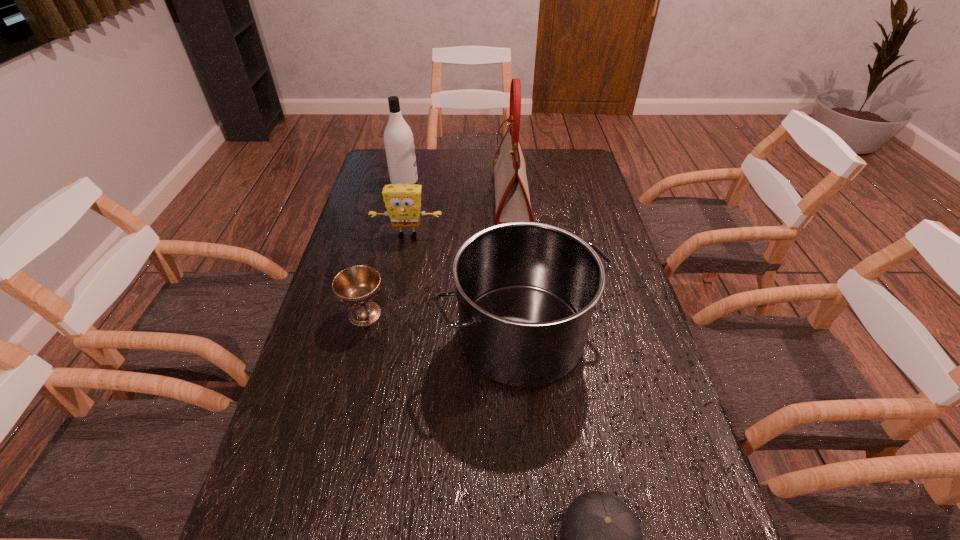
You are a GUI agent. You are given a task and a screenshot of the screen. Output one action in this format:
    pyautogui.click(x=<x>, y=<y>)
    Task: Click on the tallest object
    The image size is (960, 540).
    Given the screenshot: What is the action you would take?
    pos(512,200)

You are a GUI agent. You are given a task and a screenshot of the screen. Output one action in this format:
    pyautogui.click(x=<x>, y=<y>)
    Task: Click on the fifth shortest object
    The width and height of the screenshot is (960, 540).
    Given the screenshot: What is the action you would take?
    pyautogui.click(x=398, y=138)

At what (x,y) coordinates should I click in order to perform the action: click on the third tallest object. Please return your answer as a coordinate pair (x, y). The width and height of the screenshot is (960, 540). Looking at the image, I should click on (526, 291).

This screenshot has height=540, width=960. In order to click on the third shortest object in this screenshot , I will do `click(403, 202)`.

Identify the location of the fifth tallest object. This screenshot has width=960, height=540. [x=357, y=286].

Where is `vacant point located 0.050m on the right of the tallest object`? The height and width of the screenshot is (540, 960). vacant point located 0.050m on the right of the tallest object is located at coordinates (543, 197).

Image resolution: width=960 pixels, height=540 pixels. Identify the location of free space located on the front-facing side of the second tallest object. (516, 182).

Where is `free space located on the back of the saucepan`? free space located on the back of the saucepan is located at coordinates (511, 211).

The image size is (960, 540). In order to click on vacant space positioned on the face of the third shortest object in this screenshot , I will do `click(395, 306)`.

Where is `vacant position located 0.230m on the back of the chalice`? The height and width of the screenshot is (540, 960). vacant position located 0.230m on the back of the chalice is located at coordinates (382, 245).